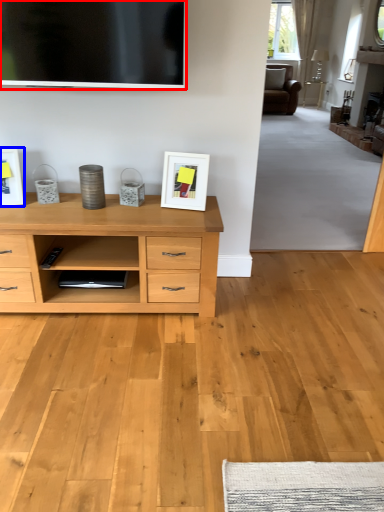
Question: Which point is further to the camera, television (highlighted by a red box) or picture frame (highlighted by a blue box)?

Choices:
 (A) television
 (B) picture frame

Answer: (B)